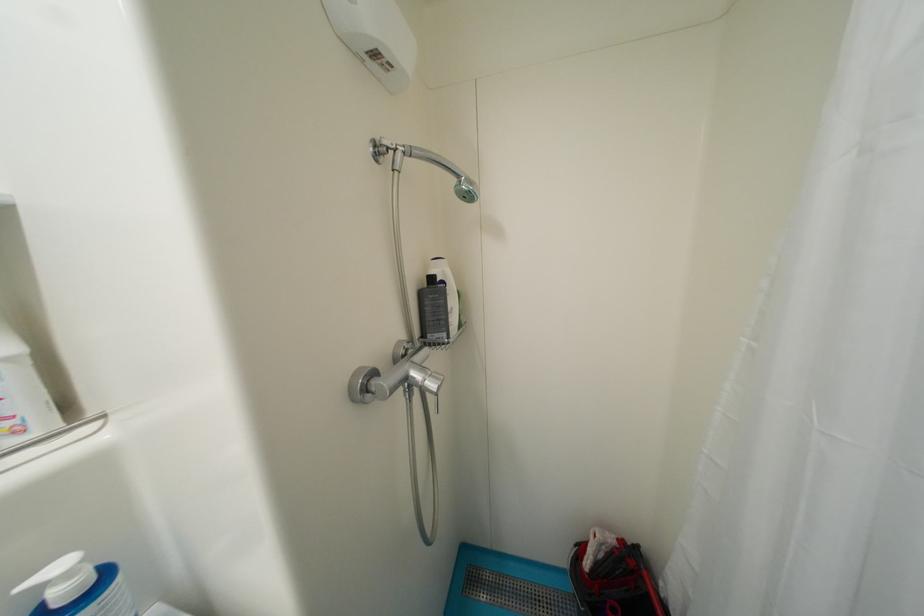
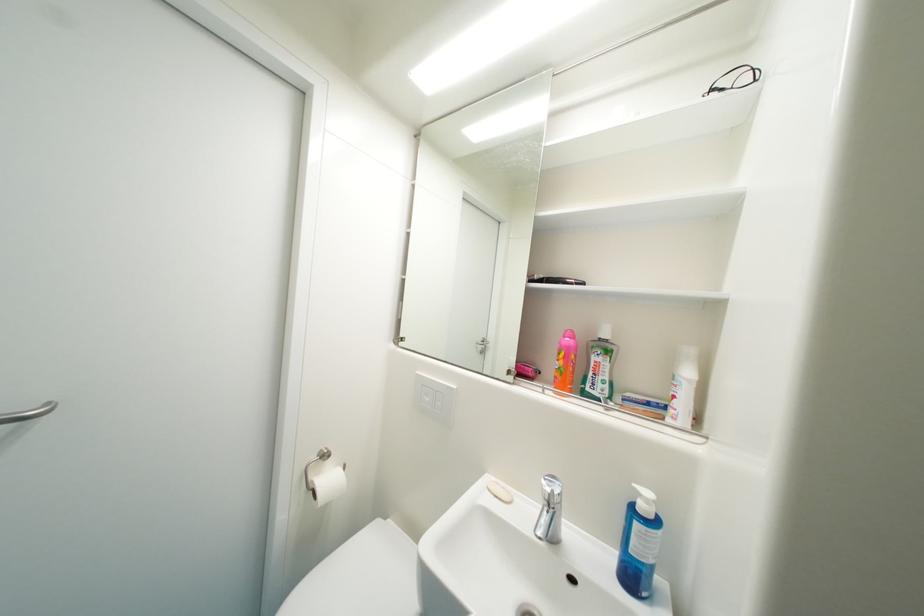
In the second image, find the point that corresponds to point (75, 576) in the first image.

(653, 503)